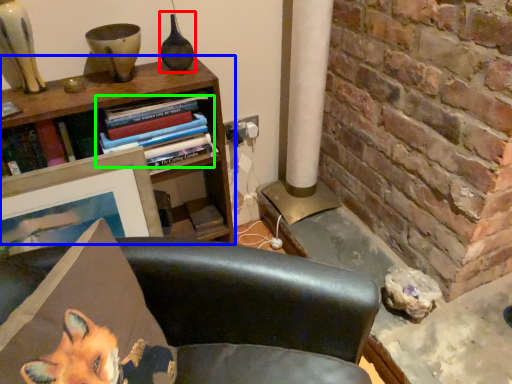
Question: Which object is the farthest from vase (highlighted by a red box)? Choose among these: bookcase (highlighted by a blue box) or book (highlighted by a green box).

Choices:
 (A) bookcase
 (B) book

Answer: (A)